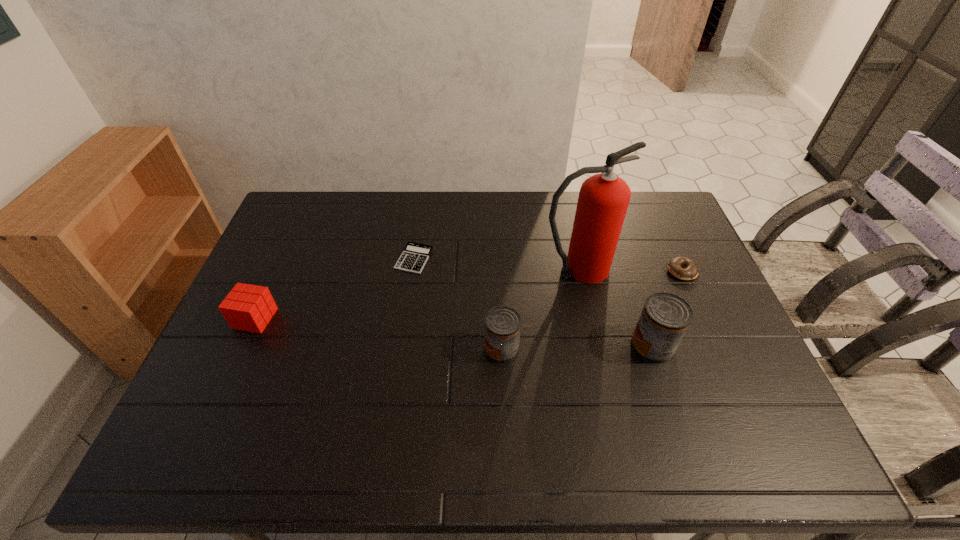
Observe the arrangement of all cans in the image. To keep them evenly spaced, where would you place another can on the left? Please locate a free space. Please provide its 2D coordinates. Your answer should be formatted as a tuple, i.e. [(x, y)], where the tuple contains the x and y coordinates of a point satisfying the conditions above.

[(348, 351)]